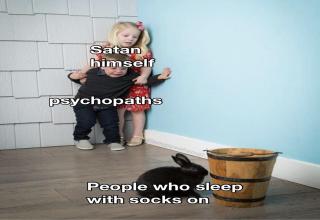
Where is `floors`? This screenshot has width=320, height=220. floors is located at coordinates (116, 170).